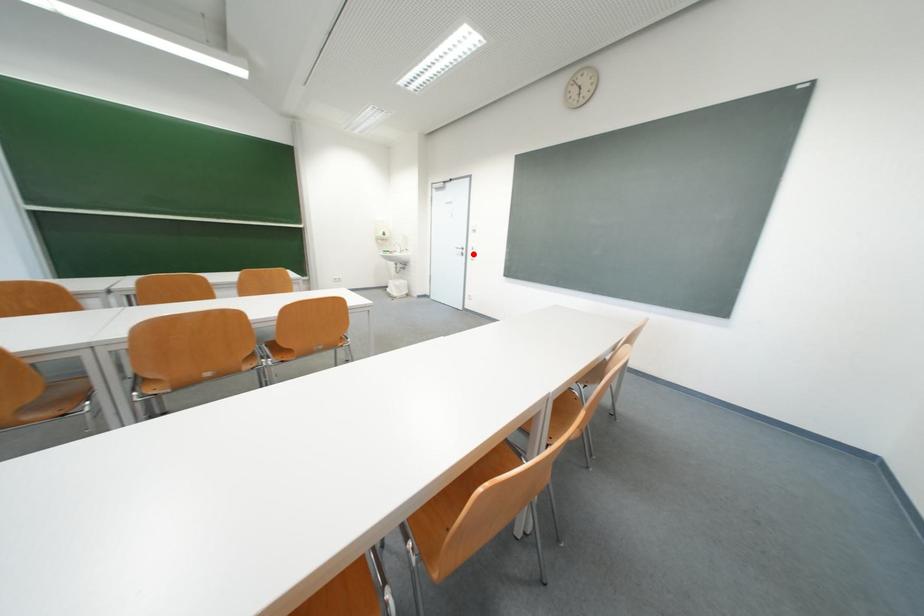
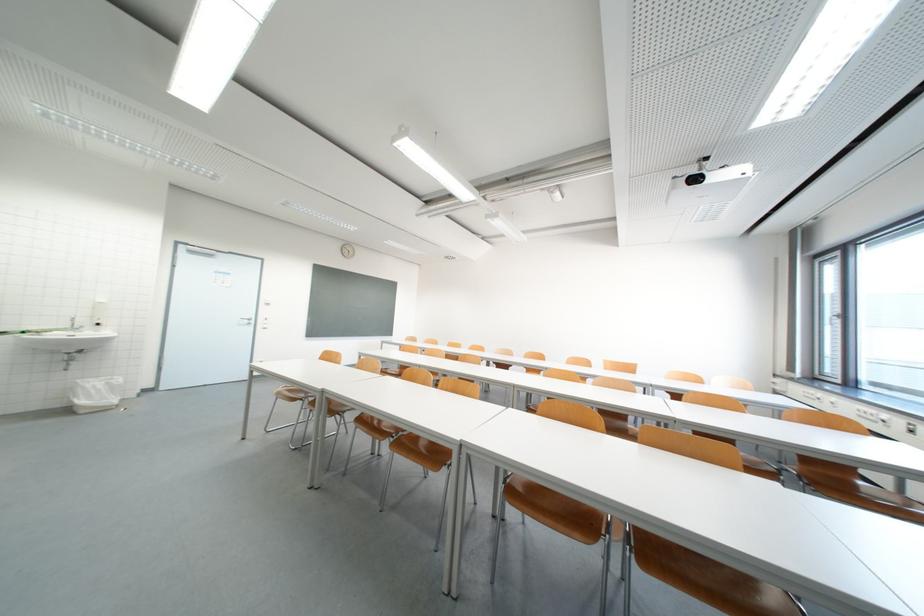
Question: I am providing you with two images of the same scene from different viewpoints. A red point is shown in image1. For the corresponding object point in image2, is it positioned nearer or farther from the camera?

Choices:
 (A) Nearer
 (B) Farther

Answer: (B)